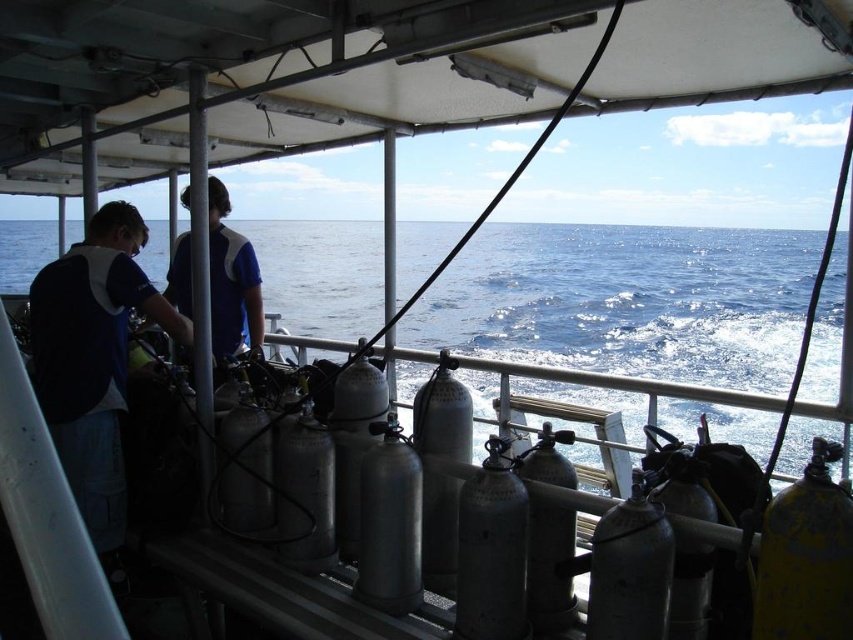
You are a diver on the boat and need to check the water level. Which object, the metallic silver water at lower center or the dark blue shirt at left, is taller?

The metallic silver water at lower center is taller than the dark blue shirt at left according to the description.